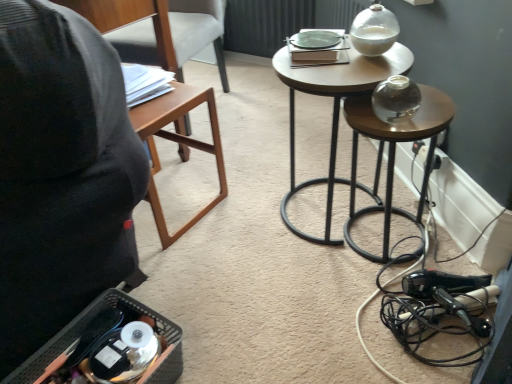
Locate an element on the screen. free space above wooden glossy stool at upper center, which ranks as the first stool in left-to-right order (from a real-world perspective) is located at coordinates (339, 64).